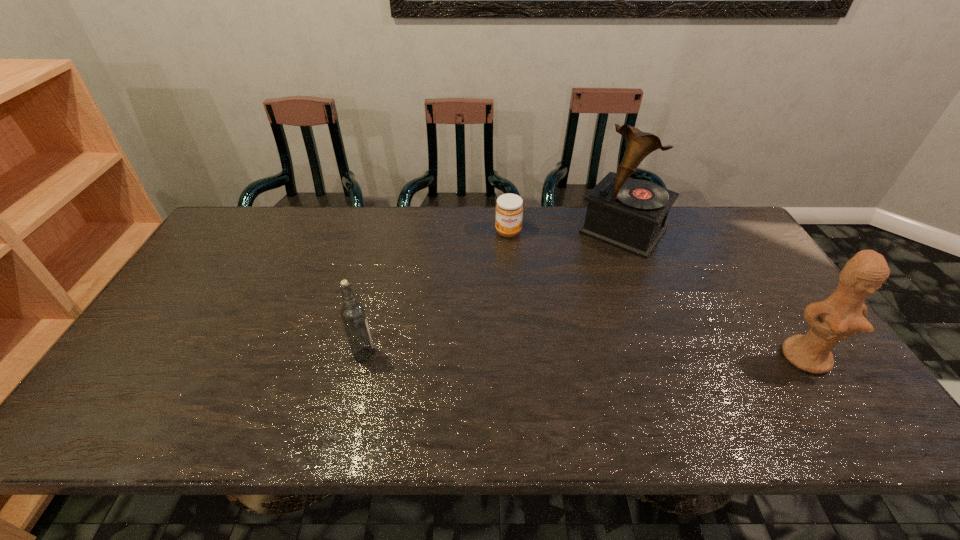
This screenshot has height=540, width=960. I want to click on the third tallest object, so click(352, 313).

This screenshot has height=540, width=960. Identify the location of vodka. (352, 313).

This screenshot has width=960, height=540. I want to click on the rightmost object, so click(x=841, y=315).

Locate an element on the screen. The width and height of the screenshot is (960, 540). figurine is located at coordinates (841, 315).

In order to click on the shortest object in this screenshot , I will do `click(509, 209)`.

In order to click on the second object from left to right in this screenshot , I will do `click(509, 209)`.

Where is `phonograph_record`? This screenshot has width=960, height=540. phonograph_record is located at coordinates (629, 214).

Image resolution: width=960 pixels, height=540 pixels. Find the location of `the second object from right to left`. the second object from right to left is located at coordinates (629, 214).

Identify the location of free region located 0.120m on the label of the second shortest object. (423, 354).

Image resolution: width=960 pixels, height=540 pixels. What are the coordinates of `vacant space located 0.300m on the front label of the shortest object` in the screenshot? It's located at (519, 308).